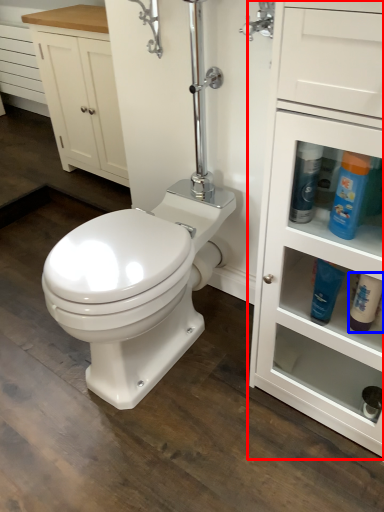
Question: Which of the following is the farthest to the observer, bathroom cabinet (highlighted by a red box) or cleaning product (highlighted by a blue box)?

Choices:
 (A) bathroom cabinet
 (B) cleaning product

Answer: (B)